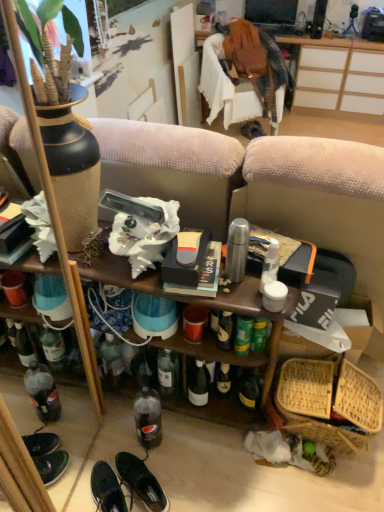
Question: Is bamboo woven basket at lower right positioned far away from black leather shoes at lower center, marked as the 1th footwear in a right-to-left arrangement?

Choices:
 (A) no
 (B) yes

Answer: (A)

Question: Is bamboo woven basket at lower right thinner than black leather shoes at lower center, which appears as the 2th footwear when viewed from the left?

Choices:
 (A) no
 (B) yes

Answer: (A)

Question: Is bamboo woven basket at lower right outside black leather shoes at lower center, marked as the 1th footwear in a right-to-left arrangement?

Choices:
 (A) no
 (B) yes

Answer: (B)

Question: Can you confirm if bamboo woven basket at lower right is positioned to the left of black leather shoes at lower center, which appears as the 2th footwear when viewed from the left?

Choices:
 (A) no
 (B) yes

Answer: (A)

Question: Is black leather shoes at lower center, marked as the 1th footwear in a right-to-left arrangement, surrounded by bamboo woven basket at lower right?

Choices:
 (A) no
 (B) yes

Answer: (A)

Question: From the image's perspective, is bamboo woven basket at lower right positioned above or below clear plastic bottle at lower center?

Choices:
 (A) above
 (B) below

Answer: (A)

Question: Does point coord(289,430) appear closer or farther from the camera than point coord(139,441)?

Choices:
 (A) closer
 (B) farther

Answer: (A)

Question: In the image, is bamboo woven basket at lower right positioned in front of or behind clear plastic bottle at lower center?

Choices:
 (A) behind
 (B) front

Answer: (A)

Question: Looking at the image, does bamboo woven basket at lower right seem bigger or smaller compared to clear plastic bottle at lower center?

Choices:
 (A) small
 (B) big

Answer: (B)

Question: In the image, is clear plastic bottle at lower center on the left side or the right side of bamboo woven basket at lower right?

Choices:
 (A) left
 (B) right

Answer: (A)

Question: From the image's perspective, is clear plastic bottle at lower center located above or below bamboo woven basket at lower right?

Choices:
 (A) below
 (B) above

Answer: (A)

Question: From a real-world perspective, is clear plastic bottle at lower center physically located above or below bamboo woven basket at lower right?

Choices:
 (A) below
 (B) above

Answer: (B)

Question: Would you say clear plastic bottle at lower center is inside or outside bamboo woven basket at lower right?

Choices:
 (A) outside
 (B) inside

Answer: (A)

Question: Is clear plastic bottle at lower center bigger or smaller than shiny black sneakers at lower left, the second footwear positioned from the right?

Choices:
 (A) small
 (B) big

Answer: (B)

Question: Considering the positions of clear plastic bottle at lower center and shiny black sneakers at lower left, the second footwear positioned from the right, in the image, is clear plastic bottle at lower center wider or thinner than shiny black sneakers at lower left, the second footwear positioned from the right,?

Choices:
 (A) thin
 (B) wide

Answer: (A)